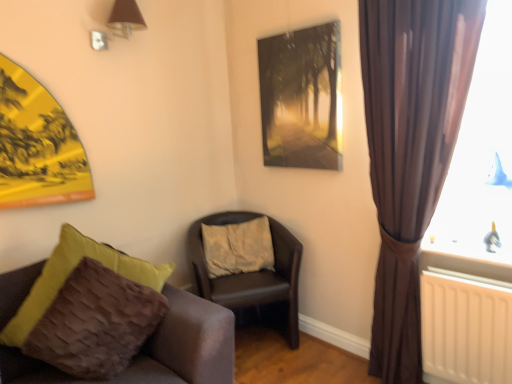
Question: From a real-world perspective, is brown textured cushion at lower left, which appears as the 2th chair when viewed from the back, physically located above or below metallic silver picture frame at upper center?

Choices:
 (A) above
 (B) below

Answer: (B)

Question: Considering the relative positions of brown textured cushion at lower left, which appears as the 2th chair when viewed from the back, and metallic silver picture frame at upper center in the image provided, is brown textured cushion at lower left, which appears as the 2th chair when viewed from the back, to the left or to the right of metallic silver picture frame at upper center?

Choices:
 (A) left
 (B) right

Answer: (A)

Question: Which object is the closest to the metallic silver picture frame at upper center?

Choices:
 (A) beige fabric pillow at center
 (B) matte brown lampshade at upper left
 (C) brown textured cushion at lower left, which appears as the 2th chair when viewed from the back
 (D) leather-like brown chair at center, arranged as the first chair when viewed from the back
 (E) brown satin curtain at right

Answer: (E)

Question: Based on their relative distances, which object is nearer to the metallic silver picture frame at upper center?

Choices:
 (A) beige fabric pillow at center
 (B) brown textured cushion at lower left, which is counted as the 1th chair, starting from the front
 (C) matte brown lampshade at upper left
 (D) leather-like brown chair at center, which is the second chair from front to back
 (E) brown satin curtain at right

Answer: (E)